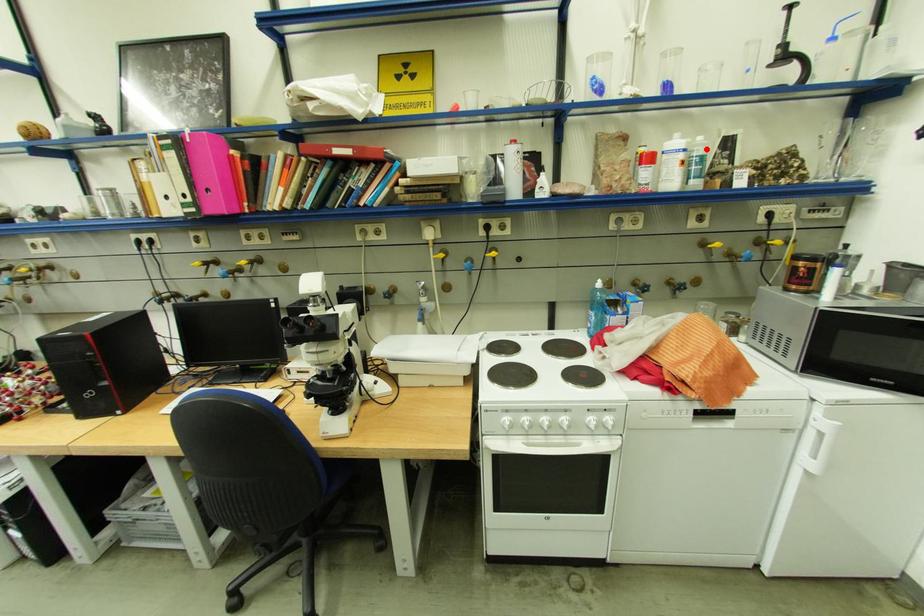
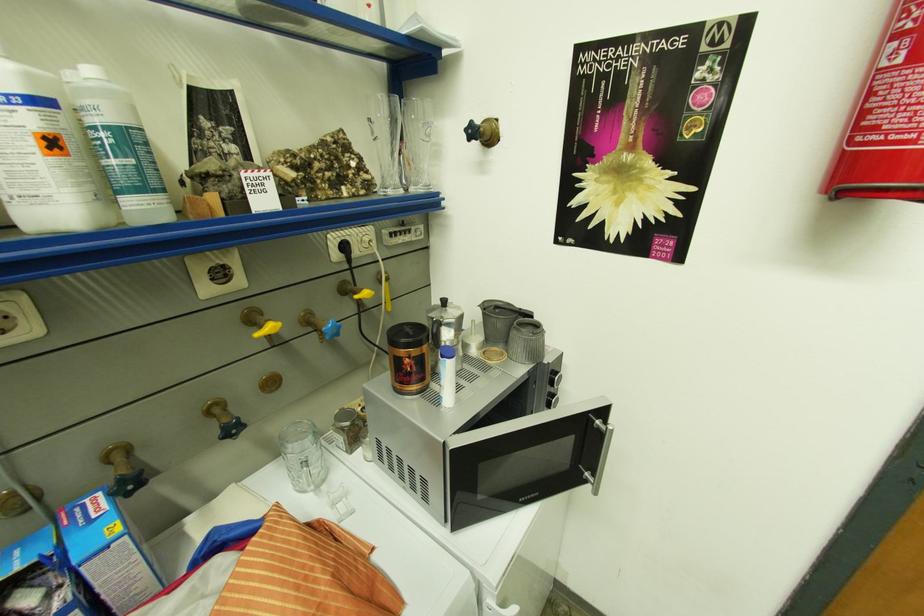
Where in the second image is the point corresponding to the highlighted location from the first image?

(98, 103)